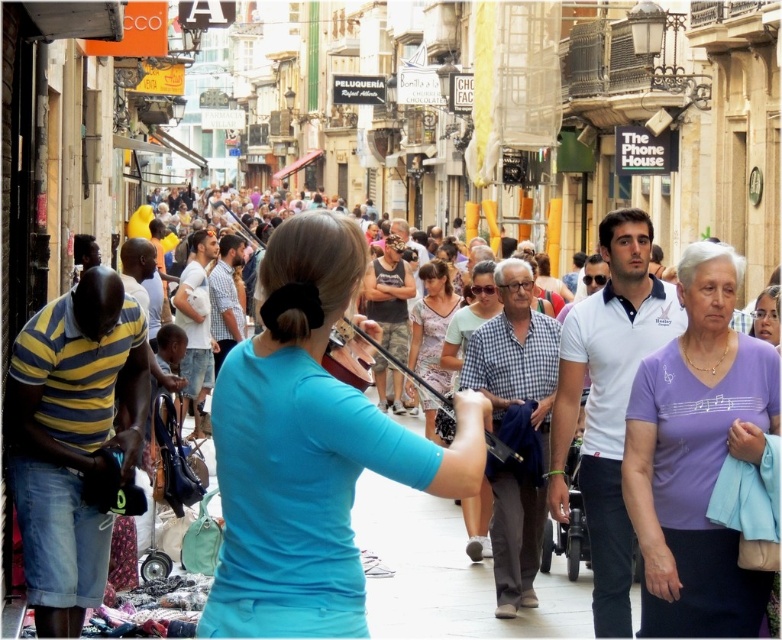
You are a photographer standing at the camera position. You want to capture a closeup of the point at coordinates point (221,579). Given that your camera has a maximum zoom range of 100 feet, can you achieve this without moving closer?

The point at coordinates point (221,579) is 135.37 feet away from the camera. Since the maximum zoom range of your camera is 100 feet, you cannot achieve a closeup of the point without moving closer.

You are a photographer standing on the street and want to take a photo of both the blue matte shirt at center and the purple cotton shirt at center. Which shirt should you adjust your camera to focus on first if you want to capture them both in the same frame?

The blue matte shirt at center is to the left of purple cotton shirt at center, so you should focus on the blue matte shirt at center first to ensure both are in the frame.

You are a photographer standing at the end of the street. You want to take a photo that includes both the blue matte shirt at center and the purple cotton shirt at center. Which shirt should you focus on first to ensure both are in frame?

The blue matte shirt at center is not as tall as the purple cotton shirt at center. Therefore, you should focus on the purple cotton shirt at center first since it is taller and will require more space in the frame to capture properly.